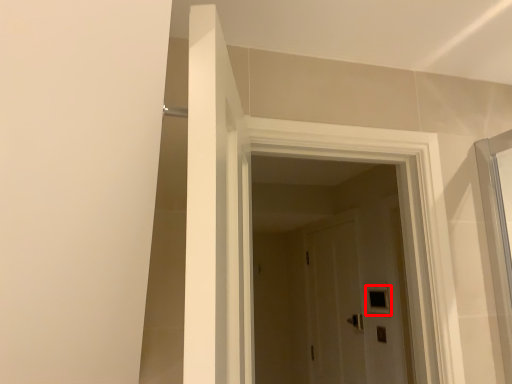
Question: Considering the relative positions of window (annotated by the red box) and door in the image provided, where is window (annotated by the red box) located with respect to the staircase?

Choices:
 (A) right
 (B) left

Answer: (A)